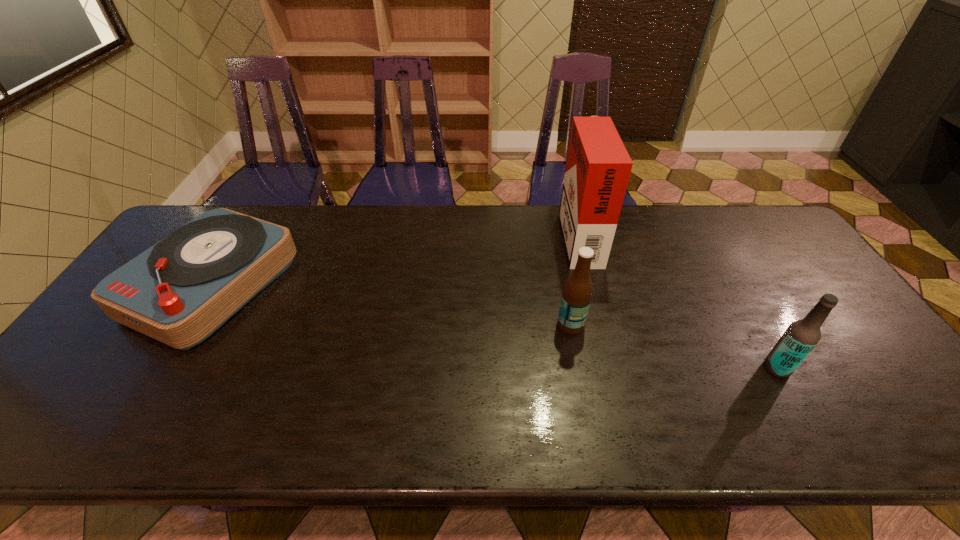
At what (x,y) coordinates should I click in order to perform the action: click on free location located on the label of the nearer beer bottle. Please return your answer as a coordinate pair (x, y). Image resolution: width=960 pixels, height=540 pixels. Looking at the image, I should click on (707, 368).

The image size is (960, 540). What are the coordinates of `blank space located on the label of the nearer beer bottle` in the screenshot? It's located at (603, 368).

The width and height of the screenshot is (960, 540). What are the coordinates of `vacant space located on the label of the nearer beer bottle` in the screenshot? It's located at (689, 368).

Locate an element on the screen. The height and width of the screenshot is (540, 960). vacant space located on the right of the record player is located at coordinates (405, 286).

Identify the location of cigarette case present at the far edge. This screenshot has height=540, width=960. (598, 166).

Where is `record player located in the far edge section of the desktop`? The width and height of the screenshot is (960, 540). record player located in the far edge section of the desktop is located at coordinates (181, 290).

Identify the location of object present at the left edge. This screenshot has height=540, width=960. (181, 290).

Identify the location of object at the far left corner. This screenshot has height=540, width=960. (181, 290).

Where is `vacant space at the far edge of the desktop`? vacant space at the far edge of the desktop is located at coordinates (345, 212).

This screenshot has height=540, width=960. Find the location of `vacant space at the near edge`. vacant space at the near edge is located at coordinates (262, 415).